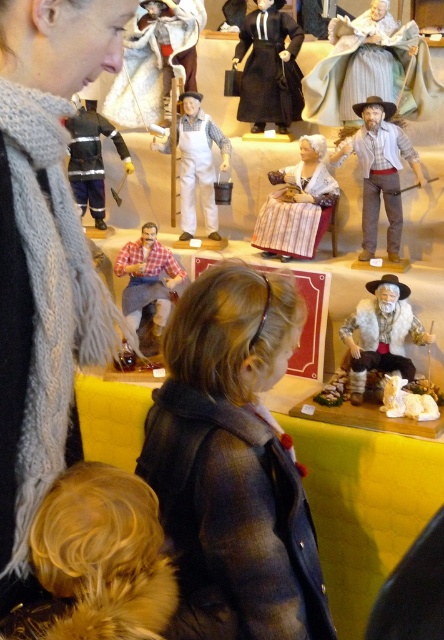
You are a tour guide explaining the display to visitors. You notice the fuzzy white beard at center and the matte black figure at left. Which of these two figures is closer to the ground?

The fuzzy white beard at center is shorter than the matte black figure at left, so it is closer to the ground.

You are standing in front of the display of miniature figurines and want to locate the matte white figurine at upper center. According to the coordinates provided, where exactly is it positioned?

The matte white figurine at upper center is positioned at coordinates point (155, 61).